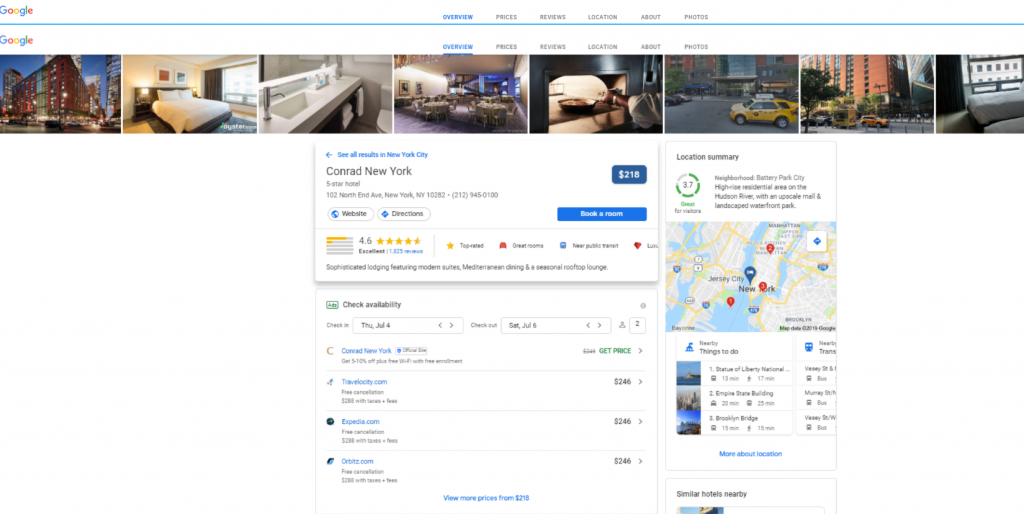
At what (x,y) coordinates should I click in order to perform the action: click on picture boxes. Please return your answer as a coordinate pair (x, y). The height and width of the screenshot is (514, 1024). Looking at the image, I should click on (99, 59), (227, 57), (341, 52), (486, 68), (587, 72), (764, 64), (856, 80), (959, 71).